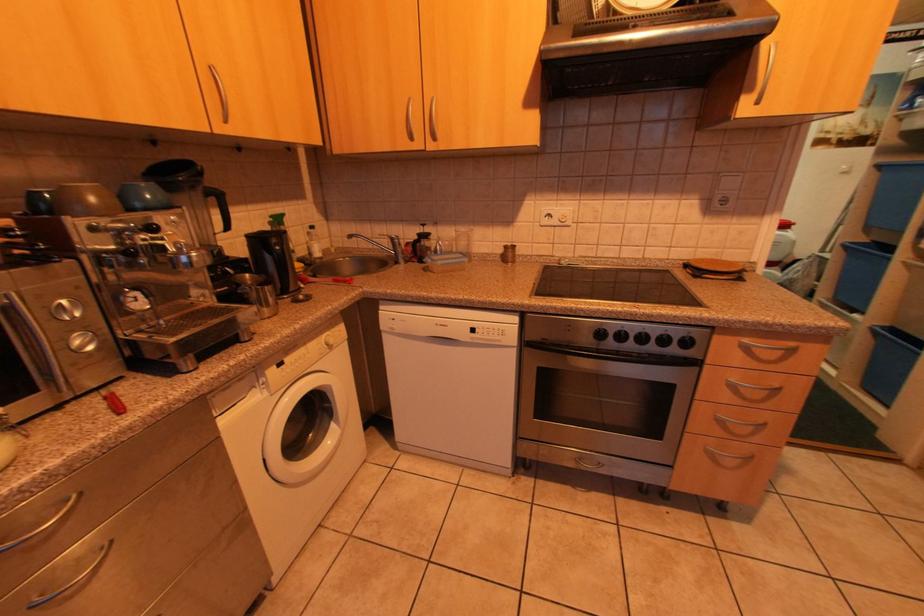
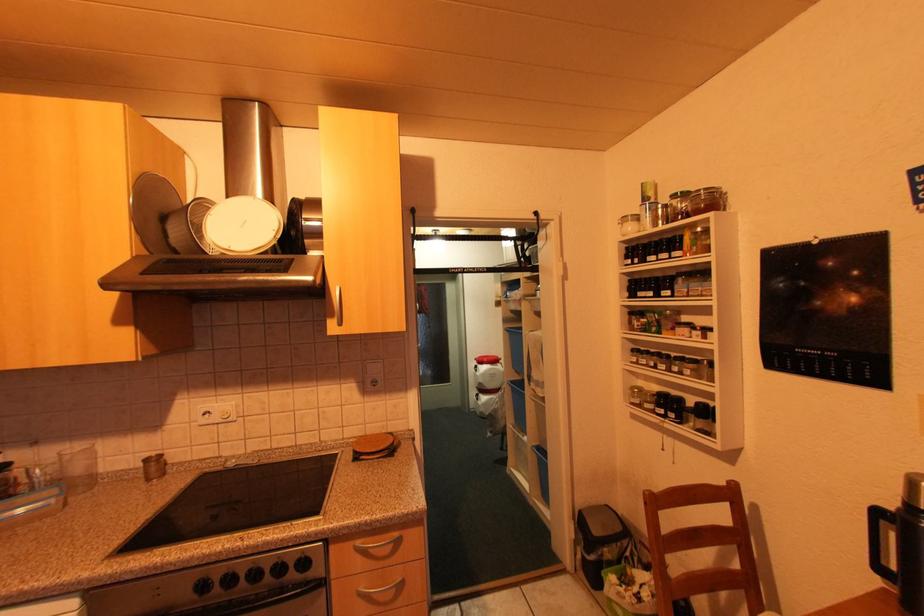
How did the camera likely rotate?

The camera rotated toward right-up.